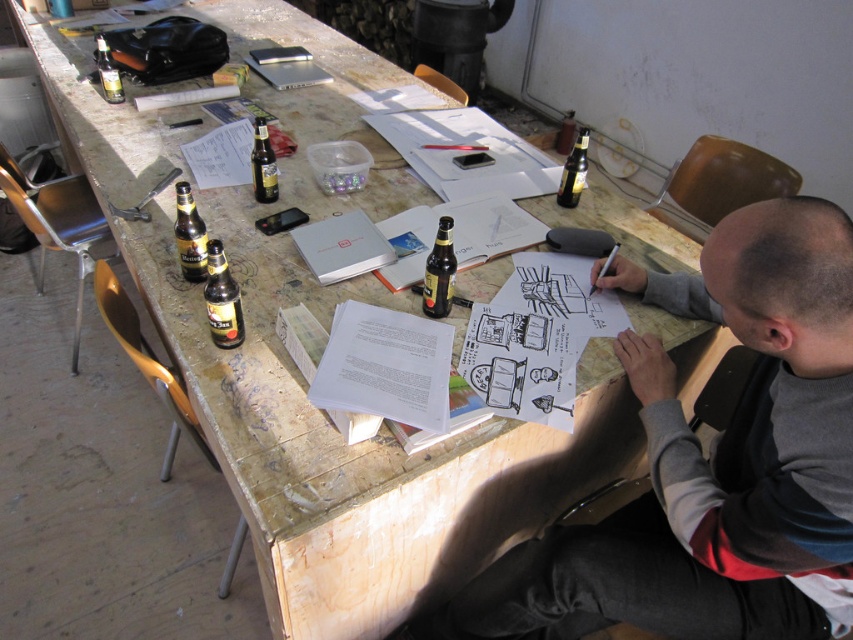
Who is lower down, brown glass bottle at left or matte glass bottle at upper right?

brown glass bottle at left

Is point (193, 225) farther from camera compared to point (556, 200)?

No, it is not.

Where is `brown glass bottle at left`? brown glass bottle at left is located at coordinates [x=189, y=236].

Can you confirm if brown glass bottle at left is positioned to the left of matte glass bottle at upper left?

In fact, brown glass bottle at left is to the right of matte glass bottle at upper left.

Does point (177, 244) come behind point (114, 88)?

No, it is not.

Who is more distant from viewer, (178,212) or (97,61)?

The point (97,61) is more distant.

Find the location of `brown glass bottle at left`. brown glass bottle at left is located at coordinates (189, 236).

Which is below, matte glass bottle at center or matte glass bottle at upper right?

matte glass bottle at upper right is below.

Can you confirm if matte glass bottle at center is shorter than matte glass bottle at upper right?

Incorrect, matte glass bottle at center's height does not fall short of matte glass bottle at upper right's.

Does point (259, 186) come behind point (585, 136)?

Yes, point (259, 186) is behind point (585, 136).

The height and width of the screenshot is (640, 853). I want to click on matte glass bottle at center, so click(263, 164).